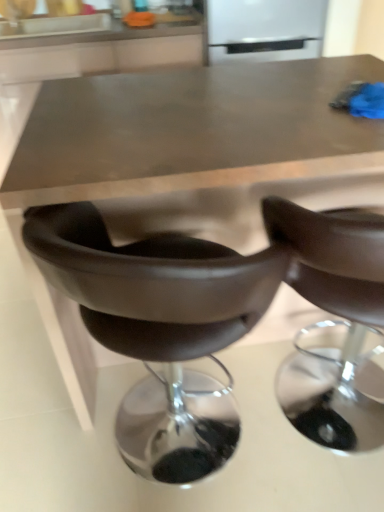
Question: Considering the relative sizes of white glossy refrigerator at upper center and brown leather chair at center, the second chair when ordered from back to front, in the image provided, is white glossy refrigerator at upper center bigger than brown leather chair at center, the second chair when ordered from back to front,?

Choices:
 (A) yes
 (B) no

Answer: (B)

Question: From a real-world perspective, does white glossy refrigerator at upper center sit lower than brown leather chair at center, the second chair when ordered from back to front?

Choices:
 (A) yes
 (B) no

Answer: (B)

Question: From a real-world perspective, is white glossy refrigerator at upper center positioned over brown leather chair at center, positioned as the first chair in front-to-back order, based on gravity?

Choices:
 (A) no
 (B) yes

Answer: (B)

Question: Would you say brown leather chair at center, positioned as the first chair in front-to-back order, is part of white glossy refrigerator at upper center's contents?

Choices:
 (A) yes
 (B) no

Answer: (B)

Question: Can you confirm if white glossy refrigerator at upper center is positioned to the right of brown leather chair at center, positioned as the first chair in front-to-back order?

Choices:
 (A) yes
 (B) no

Answer: (B)

Question: Is metallic brown table at center in front of or behind white glossy refrigerator at upper center in the image?

Choices:
 (A) front
 (B) behind

Answer: (A)

Question: Visually, is metallic brown table at center positioned to the left or to the right of white glossy refrigerator at upper center?

Choices:
 (A) right
 (B) left

Answer: (B)

Question: Based on their sizes in the image, would you say metallic brown table at center is bigger or smaller than white glossy refrigerator at upper center?

Choices:
 (A) big
 (B) small

Answer: (A)

Question: From the image's perspective, is metallic brown table at center located above or below white glossy refrigerator at upper center?

Choices:
 (A) below
 (B) above

Answer: (A)

Question: In terms of size, does white glossy refrigerator at upper center appear bigger or smaller than brown leather chair at center, the second chair when ordered from back to front?

Choices:
 (A) small
 (B) big

Answer: (A)

Question: From a real-world perspective, is white glossy refrigerator at upper center positioned above or below brown leather chair at center, positioned as the first chair in front-to-back order?

Choices:
 (A) below
 (B) above

Answer: (B)

Question: Considering the positions of point (223, 39) and point (380, 271), is point (223, 39) closer or farther from the camera than point (380, 271)?

Choices:
 (A) farther
 (B) closer

Answer: (A)

Question: Is white glossy refrigerator at upper center spatially inside brown leather chair at center, positioned as the first chair in front-to-back order, or outside of it?

Choices:
 (A) outside
 (B) inside

Answer: (A)

Question: Considering the positions of leather-like brown chair at lower center, which ranks as the 1th chair in back-to-front order, and white glossy refrigerator at upper center in the image, is leather-like brown chair at lower center, which ranks as the 1th chair in back-to-front order, wider or thinner than white glossy refrigerator at upper center?

Choices:
 (A) wide
 (B) thin

Answer: (A)

Question: Is leather-like brown chair at lower center, which ranks as the 1th chair in back-to-front order, situated inside white glossy refrigerator at upper center or outside?

Choices:
 (A) inside
 (B) outside

Answer: (B)